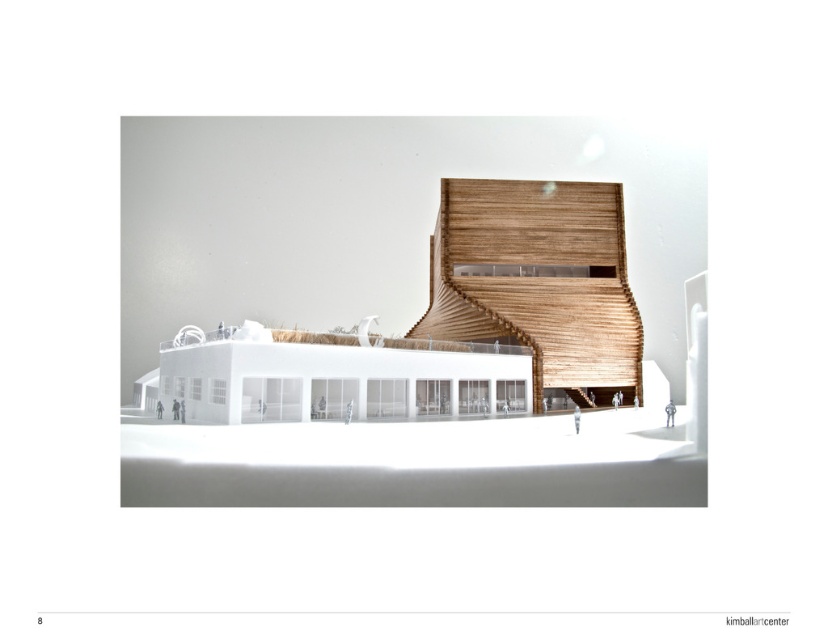
Question: Can you confirm if wooden staircase at center is positioned to the right of wooden slats at center?

Choices:
 (A) no
 (B) yes

Answer: (A)

Question: Is wooden staircase at center to the left of wooden slats at center from the viewer's perspective?

Choices:
 (A) yes
 (B) no

Answer: (A)

Question: Among these objects, which one is nearest to the camera?

Choices:
 (A) wooden slats at center
 (B) wooden staircase at center

Answer: (B)

Question: Does wooden staircase at center lie in front of wooden slats at center?

Choices:
 (A) no
 (B) yes

Answer: (B)